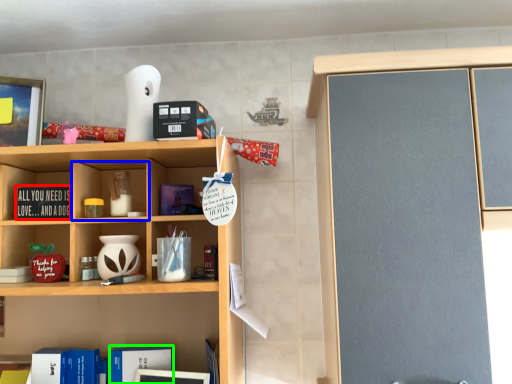
Question: Which object is the farthest from book (highlighted by a red box)? Choose among these: cabinet (highlighted by a blue box) or book (highlighted by a green box).

Choices:
 (A) cabinet
 (B) book

Answer: (B)